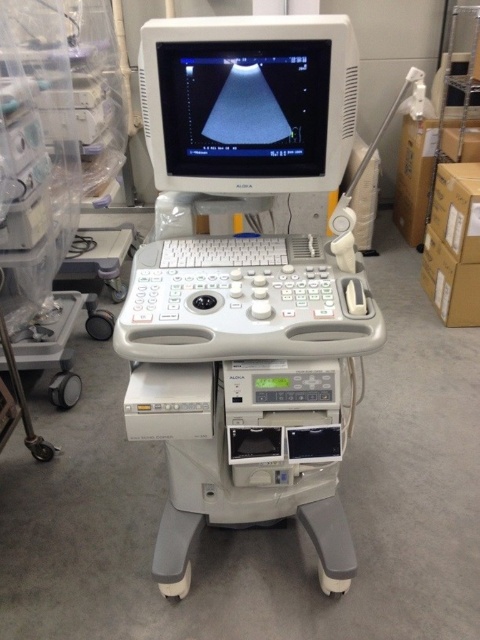
Can you confirm if white plastic ultrasound machine at center is positioned to the left of white plastic monitor at upper center?

Incorrect, white plastic ultrasound machine at center is not on the left side of white plastic monitor at upper center.

Is point (352, 285) positioned behind point (193, 138)?

No, (352, 285) is closer to viewer.

Where is `white plastic ultrasound machine at center`? white plastic ultrasound machine at center is located at coordinates (247, 385).